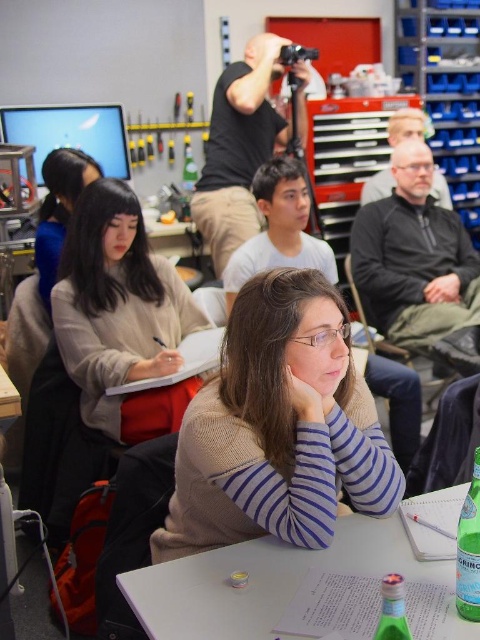
You are organizing a workshop and need to place a new object on the table. The object requires a space wider than the knit sweater at center. Can the white plastic table at center accommodate this object?

The knit sweater at center is narrower than the white plastic table at center, so the table can accommodate an object requiring more width than the sweater.

You are standing at the origin of the coordinate system in the image. There are two points marked in the scene. Which point is closer to you, point (x=477, y=506) or point (x=392, y=634)?

Point (x=392, y=634) is closer to you because it is in front of point (x=477, y=506).